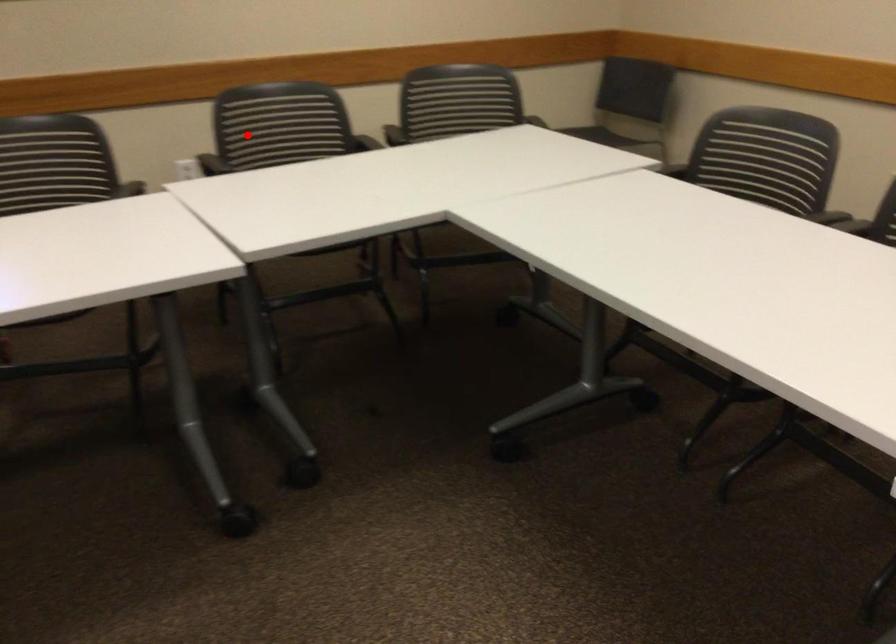
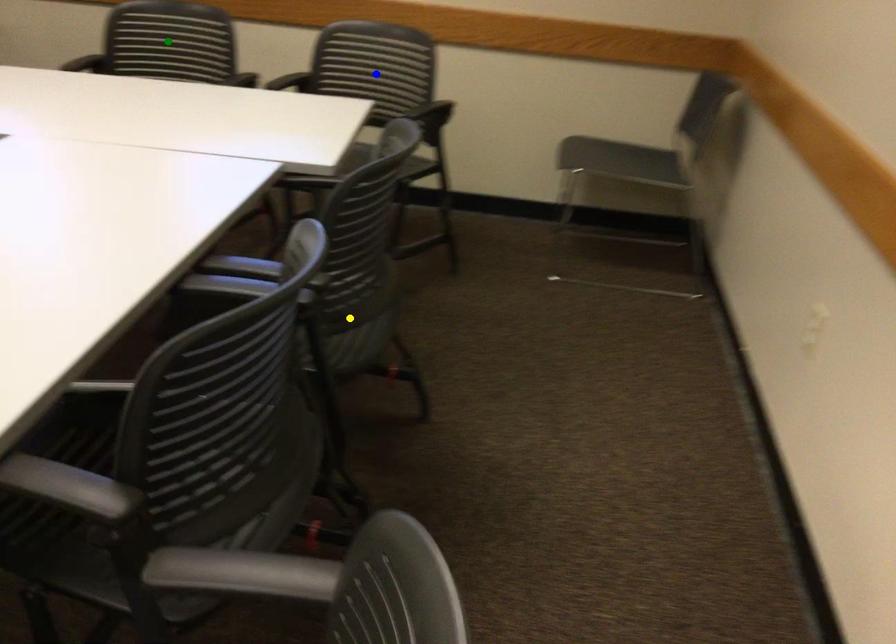
Question: I am providing you with two images of the same scene from different viewpoints. A red point is marked on the first image. You are given multiple points on the second image. Which spot in image 2 lines up with the point in image 1?

Choices:
 (A) blue point
 (B) yellow point
 (C) green point

Answer: (C)